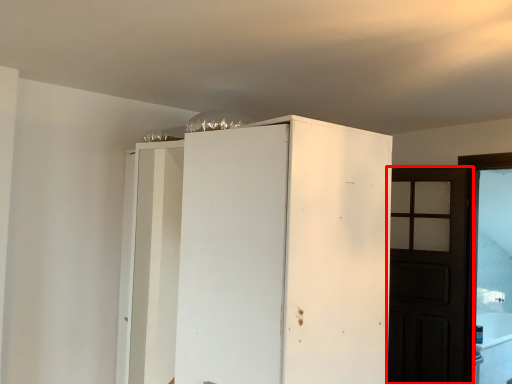
Question: From the image's perspective, considering the relative positions of door (annotated by the red box) and cupboard in the image provided, where is door (annotated by the red box) located with respect to the staircase?

Choices:
 (A) above
 (B) below

Answer: (B)